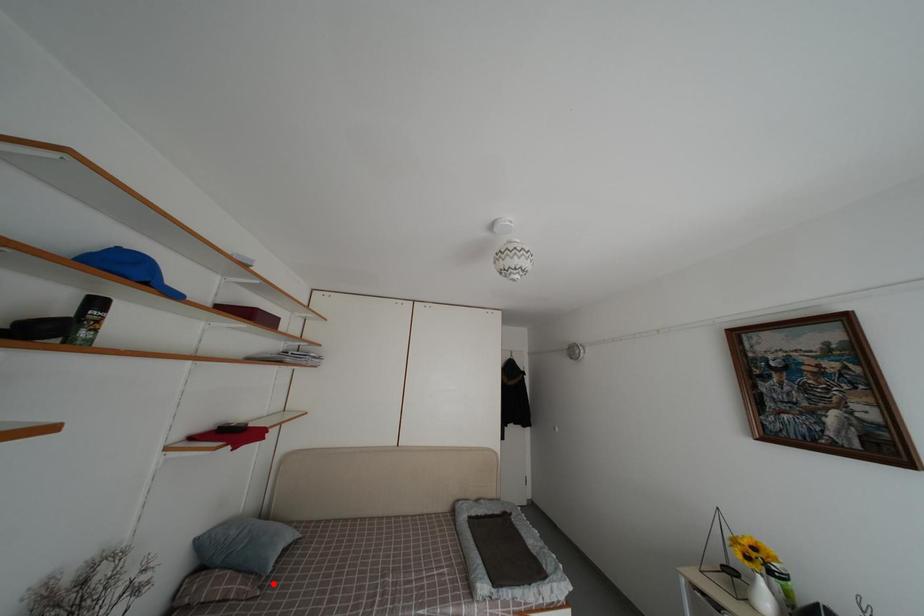
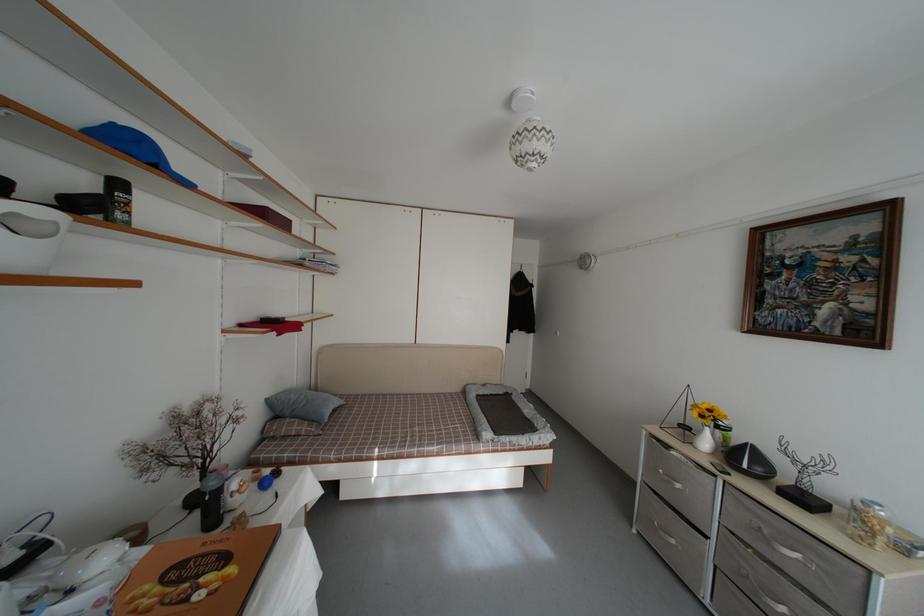
Locate, in the second image, the point that corresponds to the highlighted location in the first image.

(332, 431)